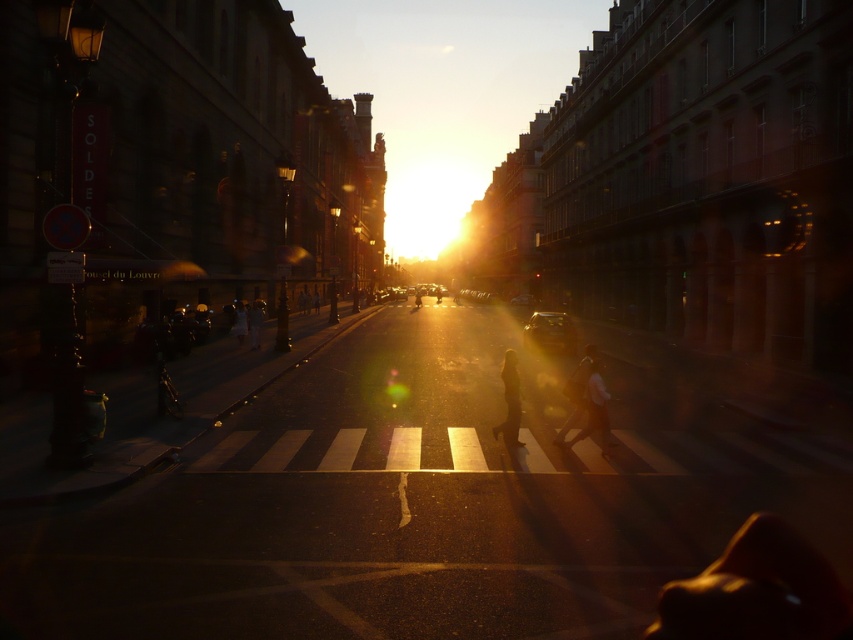
Question: Is golden hair at center further to camera compared to dark gray fabric pedestrian at center?

Choices:
 (A) no
 (B) yes

Answer: (A)

Question: Which of these objects is positioned closest to the dark gray fabric pedestrian at center?

Choices:
 (A) dark blue jeans at center
 (B) white fabric pedestrian at center
 (C) light beige fabric pedestrian at center

Answer: (C)

Question: Based on their relative distances, which object is nearer to the light brown leather jacket at center?

Choices:
 (A) golden hair at center
 (B) light brown leather bag at center
 (C) light beige fabric pedestrian at center
 (D) dark gray fabric pedestrian at center

Answer: (A)

Question: Observing the image, what is the correct spatial positioning of dark gray fabric pedestrian at center in reference to light brown leather bag at center?

Choices:
 (A) above
 (B) below

Answer: (B)

Question: Which object appears closest to the camera in this image?

Choices:
 (A) golden hair at center
 (B) white fabric pedestrian at center
 (C) light brown leather bag at center

Answer: (B)

Question: Can you confirm if white fabric pedestrian at center is smaller than light beige fabric pedestrian at center?

Choices:
 (A) yes
 (B) no

Answer: (A)